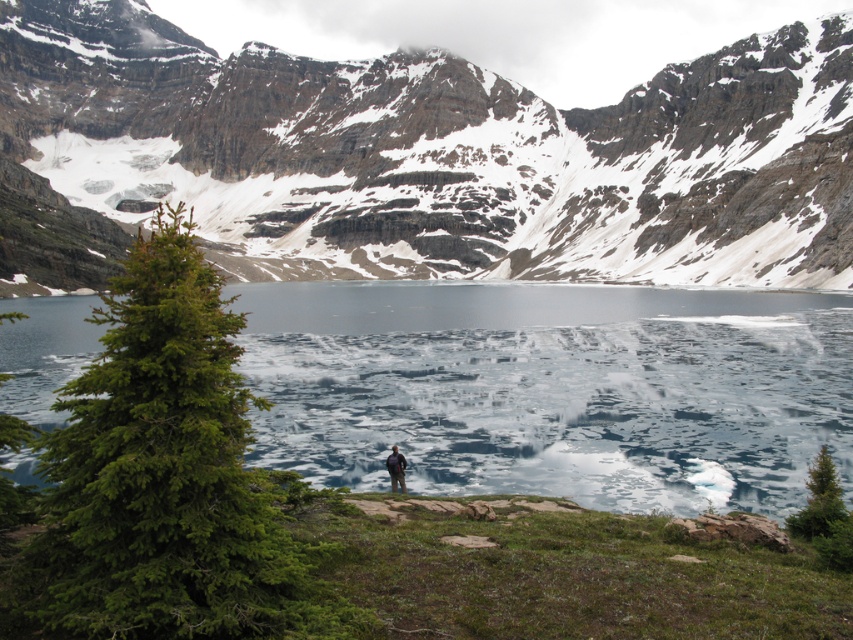
Question: Among these objects, which one is farthest from the camera?

Choices:
 (A) rocky gray mountain at upper center
 (B) green needle-like tree at left

Answer: (A)

Question: Based on their relative distances, which object is nearer to the green needle-like tree at left?

Choices:
 (A) translucent ice at center
 (B) rocky gray mountain at upper center

Answer: (A)

Question: Can you confirm if translucent ice at center is wider than dark blue fabric at center?

Choices:
 (A) no
 (B) yes

Answer: (B)

Question: Which point appears closest to the camera in this image?

Choices:
 (A) (393, 444)
 (B) (741, 356)
 (C) (242, 394)
 (D) (354, 109)

Answer: (C)

Question: Does green needle-like tree at left come behind dark blue fabric at center?

Choices:
 (A) yes
 (B) no

Answer: (B)

Question: Can you confirm if rocky gray mountain at upper center is positioned to the left of green needle-like tree at left?

Choices:
 (A) no
 (B) yes

Answer: (B)